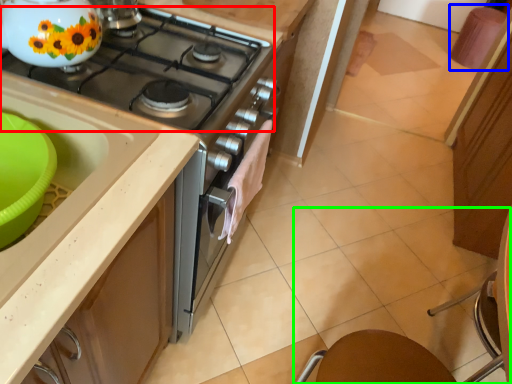
Question: Estimate the real-world distances between objects in this image. Which object is closer to gas stove (highlighted by a red box), bar stool (highlighted by a blue box) or chair (highlighted by a green box)?

Choices:
 (A) bar stool
 (B) chair

Answer: (B)